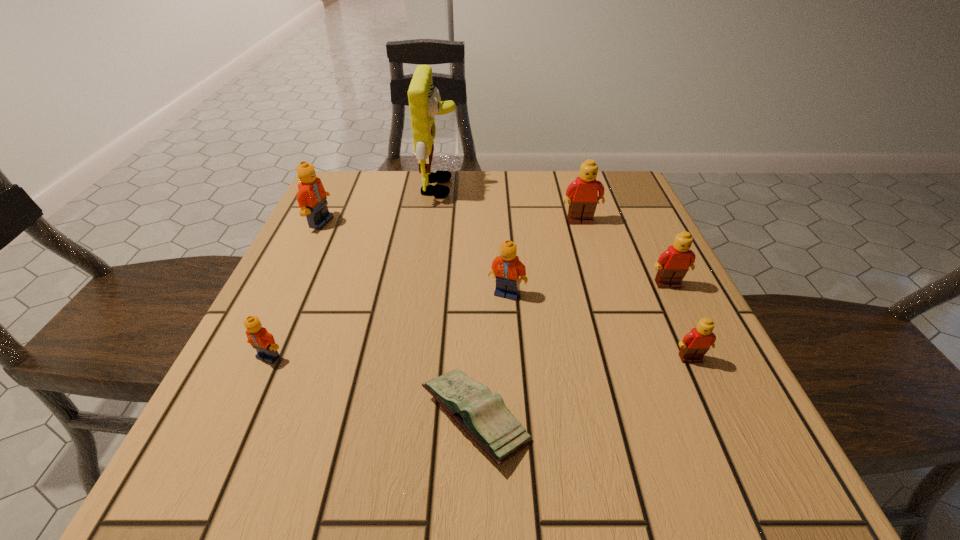
You are a GUI agent. You are given a task and a screenshot of the screen. Output one action in this format:
    pyautogui.click(x=<x>, y=<y>)
    Task: Click on the free space at the near right corner
    
    Given the screenshot: What is the action you would take?
    pyautogui.click(x=673, y=467)

Image resolution: width=960 pixels, height=540 pixels. I want to click on vacant region between the second biggest brown Lego and the biggest orange Lego, so click(494, 254).

This screenshot has height=540, width=960. I want to click on vacant space that is in between the second farthest brown Lego and the smallest orange Lego, so click(x=468, y=321).

Locate an element on the screen. vacant space that's between the second smallest orange Lego and the biggest brown Lego is located at coordinates (543, 258).

Identify the location of vacant space that is in between the biggest orange Lego and the fourth Lego from right to left. The width and height of the screenshot is (960, 540). (414, 258).

Locate an element on the screen. The height and width of the screenshot is (540, 960). empty space that is in between the second smallest brown Lego and the nearest brown Lego is located at coordinates (679, 322).

Where is `free spot between the second smallest brown Lego and the sixth object from left to right`? free spot between the second smallest brown Lego and the sixth object from left to right is located at coordinates (624, 253).

This screenshot has width=960, height=540. Identify the location of free spot between the farthest object and the smallest brown Lego. (565, 273).

You are a GUI agent. You are given a task and a screenshot of the screen. Output one action in this format:
    pyautogui.click(x=<x>, y=<y>)
    Task: Click on the vacant area that lies between the second nearest orange Lego and the smallest orange Lego
    Image resolution: width=960 pixels, height=540 pixels.
    Given the screenshot: What is the action you would take?
    pyautogui.click(x=388, y=325)

Where is `vacant space that's between the smallest orange Lego and the third Lego from left to right`? vacant space that's between the smallest orange Lego and the third Lego from left to right is located at coordinates (388, 325).